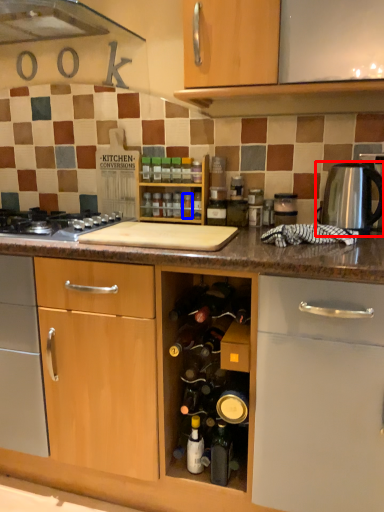
Question: Which of the following is the farthest to the observer, kitchen appliance (highlighted by a red box) or bottle (highlighted by a blue box)?

Choices:
 (A) kitchen appliance
 (B) bottle

Answer: (B)